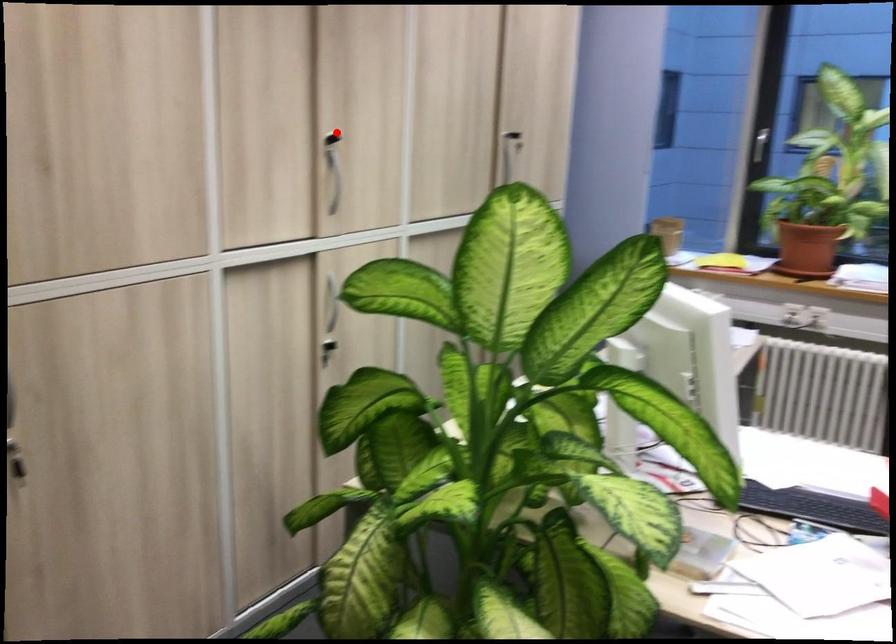
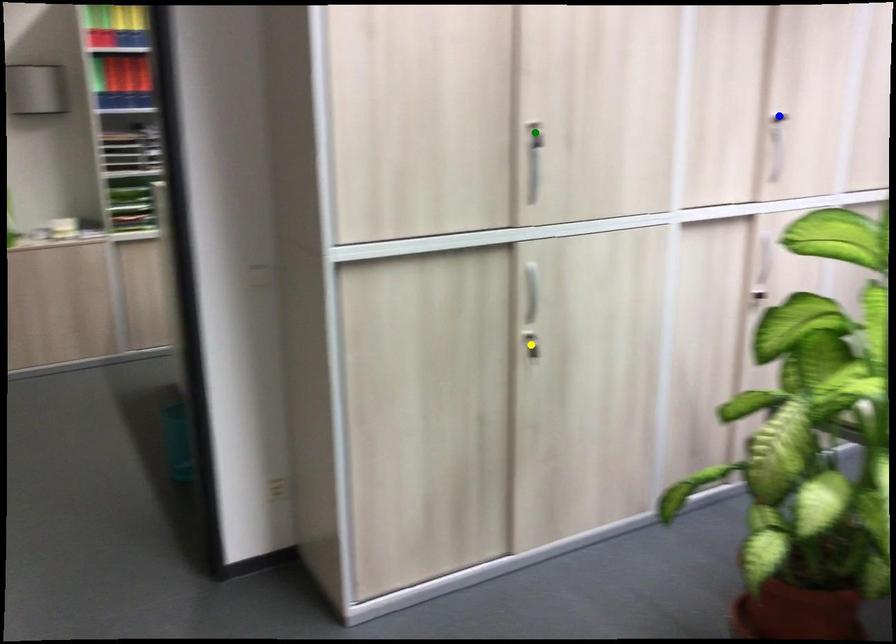
Question: I am providing you with two images of the same scene from different viewpoints. A red point is marked on the first image. You are given multiple points on the second image. Which mark in image 2 goes with the point in image 1?

Choices:
 (A) yellow point
 (B) blue point
 (C) green point

Answer: (B)